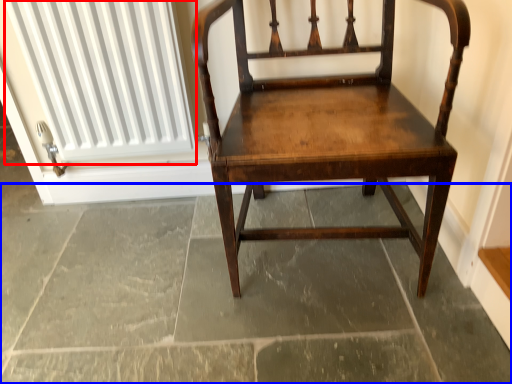
Question: Which point is further to the camera, radiator (highlighted by a red box) or concrete (highlighted by a blue box)?

Choices:
 (A) radiator
 (B) concrete

Answer: (A)